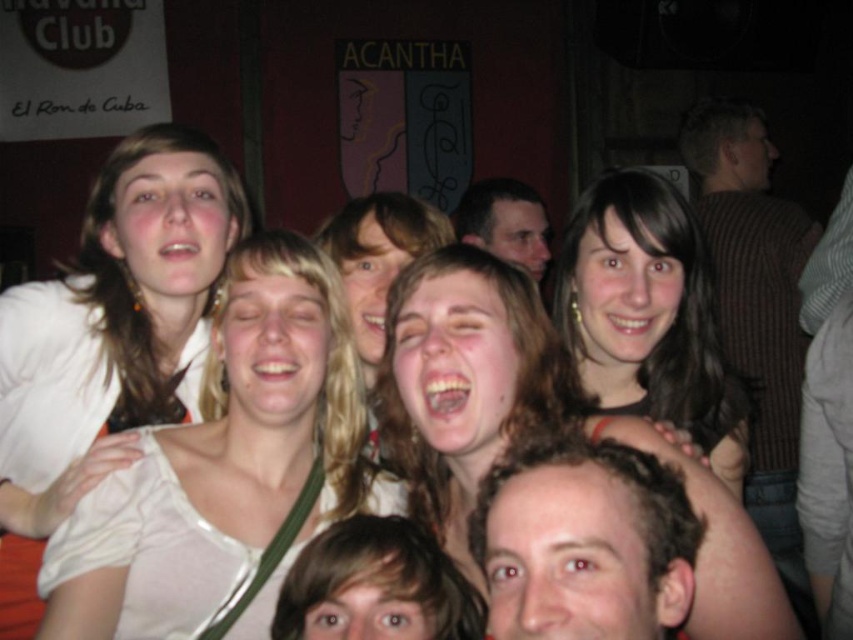
You are a photographer standing at the front of the group. You want to take a photo that includes both the smooth brown hair at center and the matte black hair at upper center. Considering the distance between them, will you need to adjust your camera lens to a wider angle to ensure both are fully visible in the frame?

The smooth brown hair at center is 4.13 feet away from matte black hair at upper center. To capture both in the same frame without cropping either, you would need to use a wider angle lens to accommodate the distance between them.

Based on the photo, you are standing in the lively group at the bar and want to move towards the red wall with the signs. Which point, point (x=128, y=403) or point (x=512, y=205), is closer to you as you move towards the wall?

Point (x=128, y=403) is closer to the viewer than point (x=512, y=205), so it would be the closer point as you move towards the wall.

You are a photographer at a Cuban themed bar. You see a smooth skin face at center and a matte black hair at upper center. Which object is positioned to the left?

The smooth skin face at center is positioned to the left of the matte black hair at upper center.